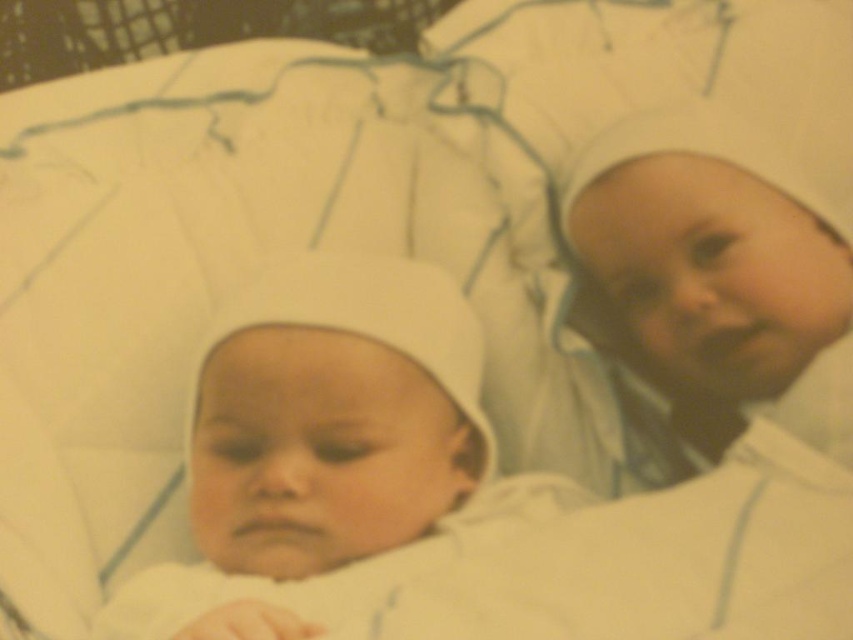
Question: Does white soft fabric newborn at lower left appear under white soft fabric newborn at right?

Choices:
 (A) yes
 (B) no

Answer: (A)

Question: Which point is farther to the camera?

Choices:
 (A) (666, 257)
 (B) (210, 481)

Answer: (A)

Question: Does white soft fabric newborn at lower left have a larger size compared to white soft fabric newborn at right?

Choices:
 (A) yes
 (B) no

Answer: (A)

Question: Can you confirm if white soft fabric newborn at lower left is positioned above white soft fabric newborn at right?

Choices:
 (A) no
 (B) yes

Answer: (A)